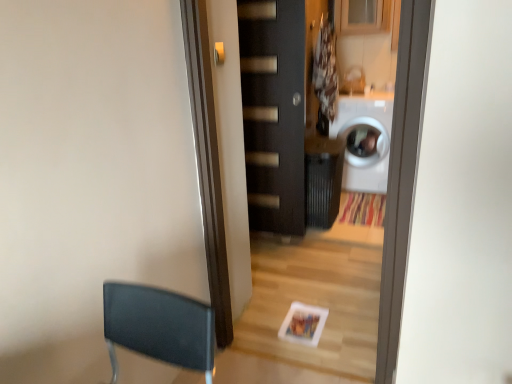
Question: Is satin silver door handle at upper center thinner than matte black door at center?

Choices:
 (A) no
 (B) yes

Answer: (B)

Question: Does satin silver door handle at upper center appear on the right side of matte black door at center?

Choices:
 (A) no
 (B) yes

Answer: (A)

Question: From a real-world perspective, is satin silver door handle at upper center located higher than matte black door at center?

Choices:
 (A) no
 (B) yes

Answer: (B)

Question: Is satin silver door handle at upper center shorter than matte black door at center?

Choices:
 (A) no
 (B) yes

Answer: (B)

Question: Is satin silver door handle at upper center located outside matte black door at center?

Choices:
 (A) no
 (B) yes

Answer: (B)

Question: Does satin silver door handle at upper center come behind matte black door at center?

Choices:
 (A) no
 (B) yes

Answer: (A)

Question: Does satin silver door handle at upper center have a larger size compared to white glossy washing machine at right?

Choices:
 (A) no
 (B) yes

Answer: (A)

Question: Can you confirm if satin silver door handle at upper center is wider than white glossy washing machine at right?

Choices:
 (A) yes
 (B) no

Answer: (B)

Question: Is white glossy washing machine at right located within satin silver door handle at upper center?

Choices:
 (A) no
 (B) yes

Answer: (A)

Question: Can you confirm if satin silver door handle at upper center is shorter than white glossy washing machine at right?

Choices:
 (A) yes
 (B) no

Answer: (A)

Question: Is there a large distance between satin silver door handle at upper center and white glossy washing machine at right?

Choices:
 (A) no
 (B) yes

Answer: (B)

Question: Considering the relative sizes of satin silver door handle at upper center and white glossy washing machine at right in the image provided, is satin silver door handle at upper center taller than white glossy washing machine at right?

Choices:
 (A) no
 (B) yes

Answer: (A)

Question: Does white glossy washing machine at right come in front of satin silver door handle at upper center?

Choices:
 (A) yes
 (B) no

Answer: (B)